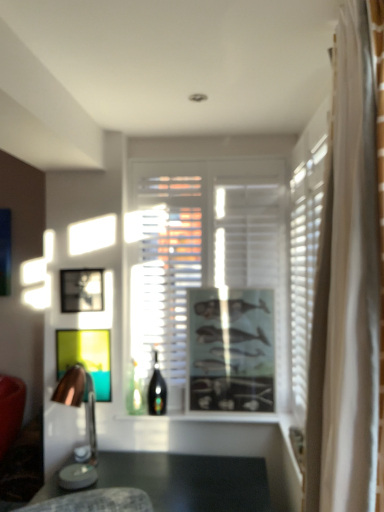
Describe the element at coordinates (81, 290) in the screenshot. This screenshot has width=384, height=512. I see `metallic silver picture frame at center, marked as the third picture frame in a right-to-left arrangement` at that location.

What is the approximate height of matte black picture frame at center, which is counted as the 2th picture frame, starting from the left?

The height of matte black picture frame at center, which is counted as the 2th picture frame, starting from the left, is 42.54 centimeters.

Locate an element on the screen. This screenshot has width=384, height=512. matte black picture frame at center, arranged as the 2th picture frame when viewed from the right is located at coordinates (86, 357).

What do you see at coordinates (79, 399) in the screenshot?
I see `wooden lampshade at left` at bounding box center [79, 399].

Describe the element at coordinates (205, 253) in the screenshot. The width and height of the screenshot is (384, 512). I see `transparent glass window at center` at that location.

What do you see at coordinates (157, 391) in the screenshot? This screenshot has height=512, width=384. I see `shiny glass bottle at center` at bounding box center [157, 391].

Find the location of `metallic silver picture frame at center, marked as the third picture frame in a right-to-left arrangement`. metallic silver picture frame at center, marked as the third picture frame in a right-to-left arrangement is located at coordinates [81, 290].

Could you tell me if matte black picture frame at center, which is counted as the 2th picture frame, starting from the left, is facing shiny glass bottle at center?

No, matte black picture frame at center, which is counted as the 2th picture frame, starting from the left, is not turned towards shiny glass bottle at center.

Is matte black picture frame at center, arranged as the 2th picture frame when viewed from the right, completely or partially outside of shiny glass bottle at center?

Indeed, matte black picture frame at center, arranged as the 2th picture frame when viewed from the right, is completely outside shiny glass bottle at center.

Considering the relative sizes of matte black picture frame at center, arranged as the 2th picture frame when viewed from the right, and shiny glass bottle at center in the image provided, is matte black picture frame at center, arranged as the 2th picture frame when viewed from the right, thinner than shiny glass bottle at center?

Yes.

Is matte black picture frame at center, which is counted as the 2th picture frame, starting from the left, to the left of shiny glass bottle at center from the viewer's perspective?

Yes.

Locate an element on the screen. The height and width of the screenshot is (512, 384). the 1st picture frame positioned above the wooden lampshade at left (from a real-world perspective) is located at coordinates (86, 357).

What's the angular difference between matte black picture frame at center, arranged as the 2th picture frame when viewed from the right, and wooden lampshade at left's facing directions?

1.51 degrees separate the facing orientations of matte black picture frame at center, arranged as the 2th picture frame when viewed from the right, and wooden lampshade at left.

In the scene shown: Considering the sizes of objects matte black picture frame at center, arranged as the 2th picture frame when viewed from the right, and wooden lampshade at left in the image provided, who is thinner, matte black picture frame at center, arranged as the 2th picture frame when viewed from the right, or wooden lampshade at left?

matte black picture frame at center, arranged as the 2th picture frame when viewed from the right.

From the image's perspective, does matte black picture frame at center, which is counted as the 2th picture frame, starting from the left, appear higher than wooden lampshade at left?

Yes, from the image's perspective, matte black picture frame at center, which is counted as the 2th picture frame, starting from the left, is over wooden lampshade at left.

You are a GUI agent. You are given a task and a screenshot of the screen. Output one action in this format:
    pyautogui.click(x=<x>, y=<y>)
    Task: Click on the picture frame that is the 1st one when counting downward from the transparent glass window at center (from the image's perspective)
    The width and height of the screenshot is (384, 512).
    Given the screenshot: What is the action you would take?
    pyautogui.click(x=81, y=290)

From the image's perspective, is metallic silver picture frame at center, marked as the third picture frame in a right-to-left arrangement, above or below transparent glass window at center?

Clearly, from the image's perspective, metallic silver picture frame at center, marked as the third picture frame in a right-to-left arrangement, is below transparent glass window at center.

Does point (88, 298) appear closer or farther from the camera than point (189, 259)?

Point (88, 298) is closer to the camera than point (189, 259).

Is point (201, 296) farther from camera compared to point (261, 196)?

No, it is in front of (261, 196).

In the scene shown: Between matte black picture frame at center, the 3th picture frame when ordered from left to right, and transparent glass window at center, which one has smaller size?

matte black picture frame at center, the 3th picture frame when ordered from left to right.

How many degrees apart are the facing directions of matte black picture frame at center, acting as the 1th picture frame starting from the right, and transparent glass window at center?

0.44 degrees.

From the image's perspective, relative to transparent glass window at center, is matte black picture frame at center, the 3th picture frame when ordered from left to right, above or below?

matte black picture frame at center, the 3th picture frame when ordered from left to right, is situated lower than transparent glass window at center in the image.

Considering the relative positions of transparent glass window at center and matte black picture frame at center, the 3th picture frame when ordered from left to right, in the image provided, is transparent glass window at center to the right of matte black picture frame at center, the 3th picture frame when ordered from left to right, from the viewer's perspective?

No.

Does point (275, 240) appear closer or farther from the camera than point (206, 371)?

Point (275, 240).

Which object is more forward, transparent glass window at center or matte black picture frame at center, the 3th picture frame when ordered from left to right?

matte black picture frame at center, the 3th picture frame when ordered from left to right, is in front.

From the picture: Would you say transparent glass window at center is inside or outside matte black picture frame at center, the 3th picture frame when ordered from left to right?

transparent glass window at center is not inside matte black picture frame at center, the 3th picture frame when ordered from left to right, it's outside.

Between wooden lampshade at left and metallic silver picture frame at center, the first picture frame positioned from the left, which one is positioned in front?

wooden lampshade at left.

From the image's perspective, which object appears higher, wooden lampshade at left or metallic silver picture frame at center, the first picture frame positioned from the left?

metallic silver picture frame at center, the first picture frame positioned from the left, is shown above in the image.

Is metallic silver picture frame at center, the first picture frame positioned from the left, at the back of wooden lampshade at left?

That's not correct — wooden lampshade at left is not looking away from metallic silver picture frame at center, the first picture frame positioned from the left.

This screenshot has height=512, width=384. What are the coordinates of `picture frame that is the 2nd one when counting forward from the matte black picture frame at center, which is counted as the 2th picture frame, starting from the left` in the screenshot? It's located at (231, 350).

From a real-world perspective, is matte black picture frame at center, which is counted as the 2th picture frame, starting from the left, physically located above or below matte black picture frame at center, acting as the 1th picture frame starting from the right?

matte black picture frame at center, which is counted as the 2th picture frame, starting from the left, is situated lower than matte black picture frame at center, acting as the 1th picture frame starting from the right, in the real world.

From the image's perspective, which is above, matte black picture frame at center, which is counted as the 2th picture frame, starting from the left, or matte black picture frame at center, acting as the 1th picture frame starting from the right?

From the image's view, matte black picture frame at center, acting as the 1th picture frame starting from the right, is above.

This screenshot has height=512, width=384. Identify the location of picture frame that is the 1st one when counting upward from the shiny glass bottle at center (from the image's perspective). (86, 357).

Where is `lamp below the matte black picture frame at center, arranged as the 2th picture frame when viewed from the right (from the image's perspective)`? This screenshot has height=512, width=384. lamp below the matte black picture frame at center, arranged as the 2th picture frame when viewed from the right (from the image's perspective) is located at coordinates (79, 399).

Based on their spatial positions, is transparent glass window at center or matte black picture frame at center, acting as the 1th picture frame starting from the right, further from wooden lampshade at left?

transparent glass window at center lies further to wooden lampshade at left than the other object.

Based on their spatial positions, is metallic silver picture frame at center, marked as the third picture frame in a right-to-left arrangement, or matte black picture frame at center, acting as the 1th picture frame starting from the right, further from wooden lampshade at left?

Among the two, matte black picture frame at center, acting as the 1th picture frame starting from the right, is located further to wooden lampshade at left.

Which object lies nearer to the anchor point wooden lampshade at left, metallic silver picture frame at center, marked as the third picture frame in a right-to-left arrangement, or transparent glass window at center?

metallic silver picture frame at center, marked as the third picture frame in a right-to-left arrangement, is closer to wooden lampshade at left.

When comparing their distances from transparent glass window at center, does matte black picture frame at center, which is counted as the 2th picture frame, starting from the left, or matte black picture frame at center, the 3th picture frame when ordered from left to right, seem closer?

The object closer to transparent glass window at center is matte black picture frame at center, the 3th picture frame when ordered from left to right.

Estimate the real-world distances between objects in this image. Which object is further from transparent glass window at center, metallic silver picture frame at center, the first picture frame positioned from the left, or wooden lampshade at left?

Based on the image, wooden lampshade at left appears to be further to transparent glass window at center.

Based on the photo, from the image, which object appears to be farther from matte black picture frame at center, which is counted as the 2th picture frame, starting from the left, wooden lampshade at left or shiny glass bottle at center?

shiny glass bottle at center is positioned further to the anchor matte black picture frame at center, which is counted as the 2th picture frame, starting from the left.

Considering their positions, is metallic silver picture frame at center, the first picture frame positioned from the left, positioned further to shiny glass bottle at center than wooden lampshade at left?

Among the two, metallic silver picture frame at center, the first picture frame positioned from the left, is located further to shiny glass bottle at center.

From the image, which object appears to be farther from transparent glass window at center, metallic silver picture frame at center, marked as the third picture frame in a right-to-left arrangement, or matte black picture frame at center, acting as the 1th picture frame starting from the right?

The object further to transparent glass window at center is metallic silver picture frame at center, marked as the third picture frame in a right-to-left arrangement.

I want to click on bottle situated between matte black picture frame at center, arranged as the 2th picture frame when viewed from the right, and transparent glass window at center from left to right, so 157,391.

At what (x,y) coordinates should I click in order to perform the action: click on lamp between matte black picture frame at center, which is counted as the 2th picture frame, starting from the left, and matte black picture frame at center, the 3th picture frame when ordered from left to right. Please return your answer as a coordinate pair (x, y). The height and width of the screenshot is (512, 384). Looking at the image, I should click on (79, 399).

This screenshot has width=384, height=512. I want to click on bottle between matte black picture frame at center, which is counted as the 2th picture frame, starting from the left, and matte black picture frame at center, the 3th picture frame when ordered from left to right, from left to right, so click(x=157, y=391).

Where is `bottle that lies between transparent glass window at center and wooden lampshade at left from top to bottom`? bottle that lies between transparent glass window at center and wooden lampshade at left from top to bottom is located at coordinates (157, 391).